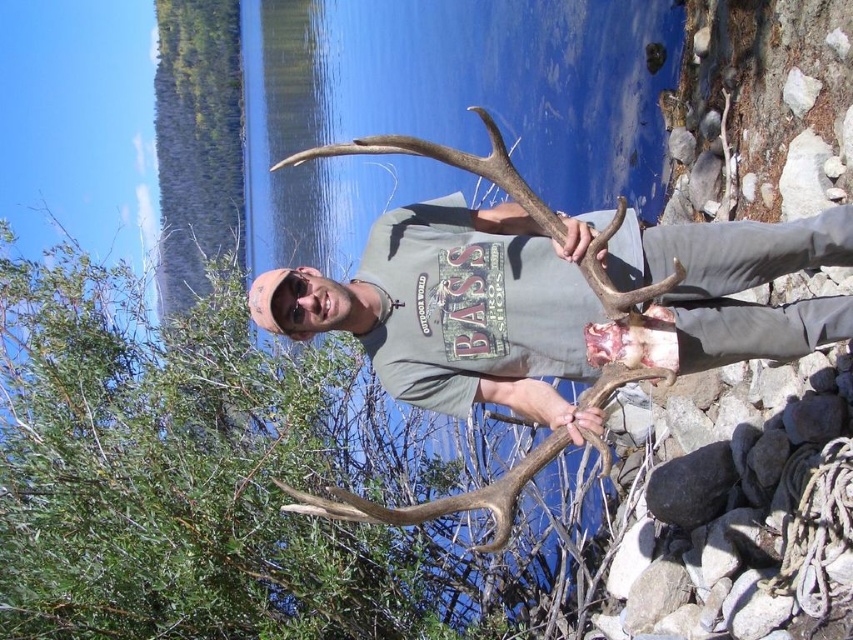
What is the exact coordinate of the green leafy bush at center?

The green leafy bush at center is located at point (198, 474).